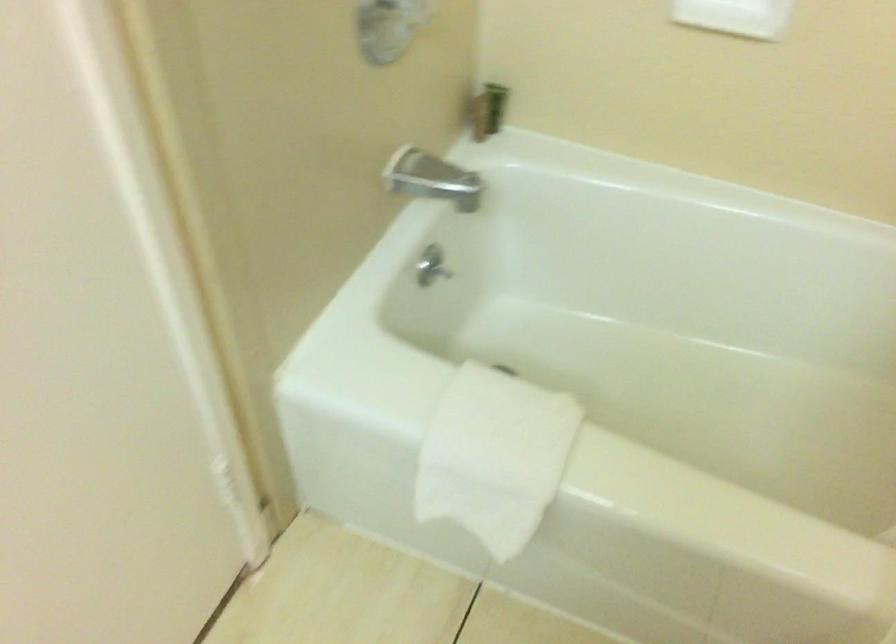
Image resolution: width=896 pixels, height=644 pixels. Identify the location of metal diverter knob. (431, 266).